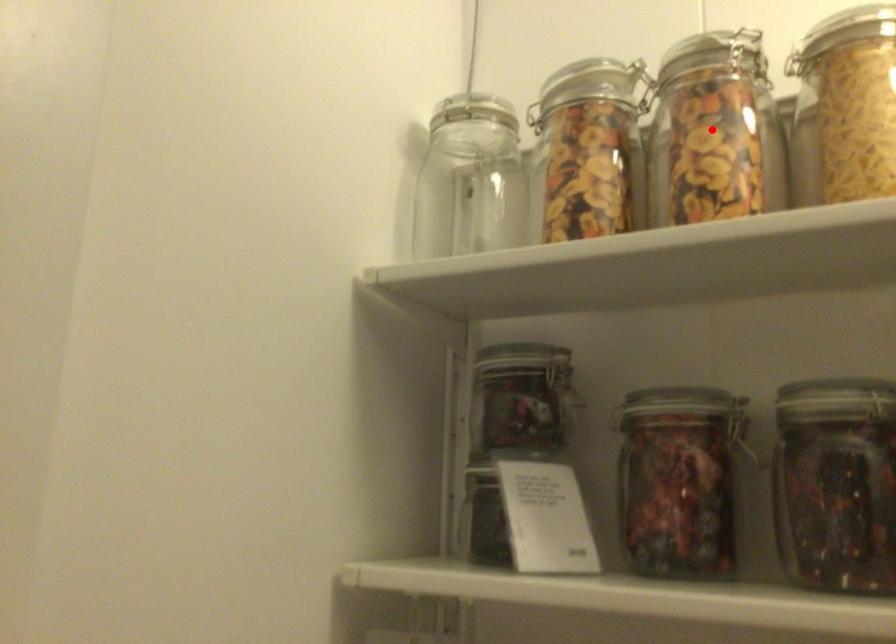
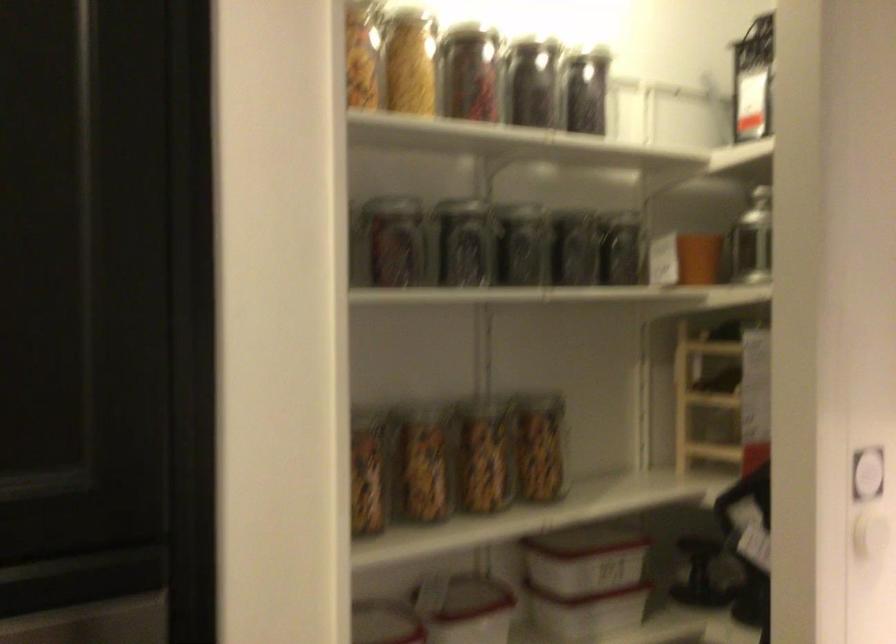
Where in the second image is the point corresponding to the highlighted location from the first image?

(363, 53)